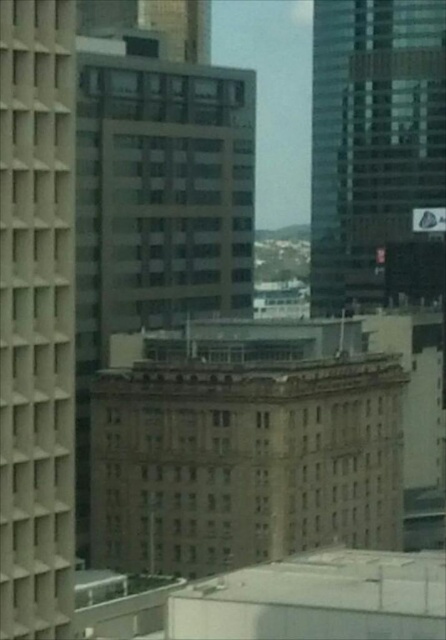
Question: Which is nearer to the beige concrete building at left?

Choices:
 (A) glassy reflective skyscraper at upper right
 (B) brown stone building at center

Answer: (B)

Question: Does beige concrete building at left appear on the right side of glassy reflective skyscraper at upper right?

Choices:
 (A) yes
 (B) no

Answer: (B)

Question: Which object is closer to the camera taking this photo?

Choices:
 (A) beige concrete building at left
 (B) brown stone building at center
 (C) glassy reflective skyscraper at upper right

Answer: (A)

Question: Considering the relative positions of beige concrete building at left and glassy reflective skyscraper at upper right in the image provided, where is beige concrete building at left located with respect to glassy reflective skyscraper at upper right?

Choices:
 (A) right
 (B) left

Answer: (B)

Question: Which of the following is the farthest from the observer?

Choices:
 (A) brown stone building at center
 (B) glassy reflective skyscraper at upper right

Answer: (B)

Question: Is beige concrete building at left bigger than glassy reflective skyscraper at upper right?

Choices:
 (A) no
 (B) yes

Answer: (A)